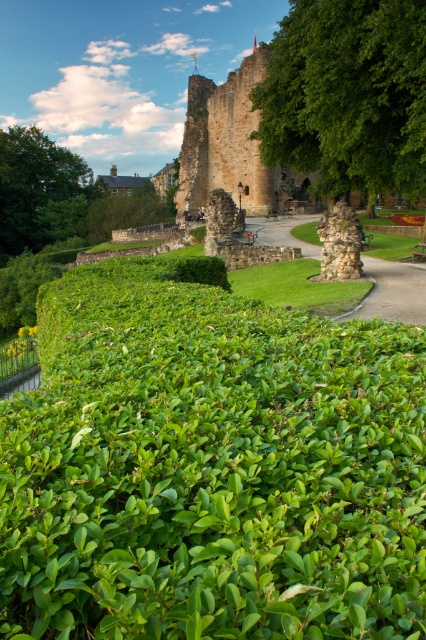
You are standing in the garden and see the green leafy tree at center and the green leafy tree at upper left. Which tree is positioned more to the east?

The green leafy tree at center is to the right of green leafy tree at upper left, so the green leafy tree at center is positioned more to the east.

From the picture: What is the 2D coordinate of the green leafy tree at center in the image?

The green leafy tree at center is located at the 2D coordinate point of (348, 93).